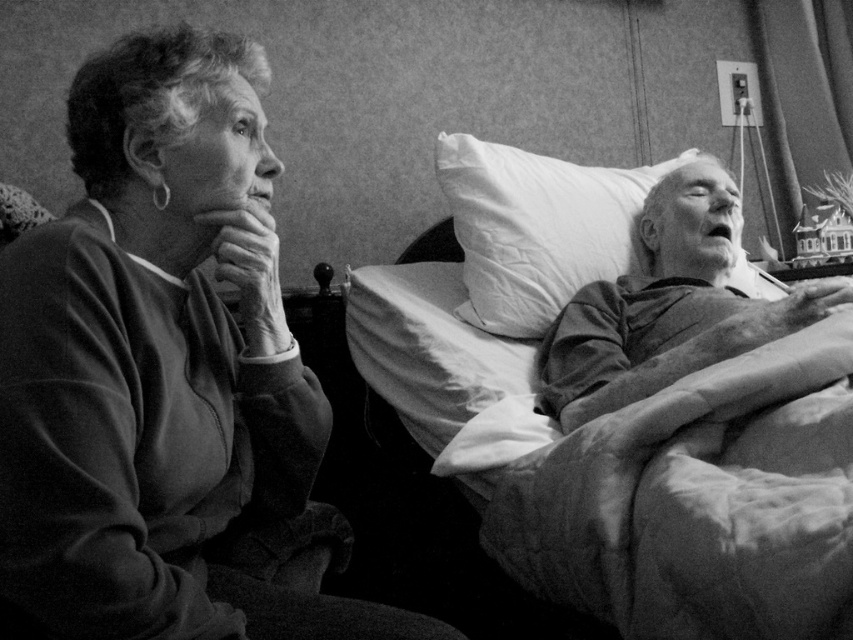
Is sweatshirt at left closer to the viewer compared to white soft pillow at right?

Yes, sweatshirt at left is closer to the viewer.

Which of these two, sweatshirt at left or white soft pillow at right, stands taller?

sweatshirt at left is taller.

Is point (183, 630) positioned after point (457, 308)?

No.

Image resolution: width=853 pixels, height=640 pixels. Find the location of `sweatshirt at left`. sweatshirt at left is located at coordinates (165, 378).

Based on the photo, does sweatshirt at left appear on the right side of fluffy white pillow at right?

Incorrect, sweatshirt at left is not on the right side of fluffy white pillow at right.

Looking at this image, which of these two, sweatshirt at left or fluffy white pillow at right, stands taller?

sweatshirt at left is taller.

You are a GUI agent. You are given a task and a screenshot of the screen. Output one action in this format:
    pyautogui.click(x=<x>, y=<y>)
    Task: Click on the sweatshirt at left
    The width and height of the screenshot is (853, 640).
    Given the screenshot: What is the action you would take?
    pyautogui.click(x=165, y=378)

Locate an element on the screen. fluffy white pillow at right is located at coordinates (633, 468).

The width and height of the screenshot is (853, 640). Identify the location of fluffy white pillow at right. (633, 468).